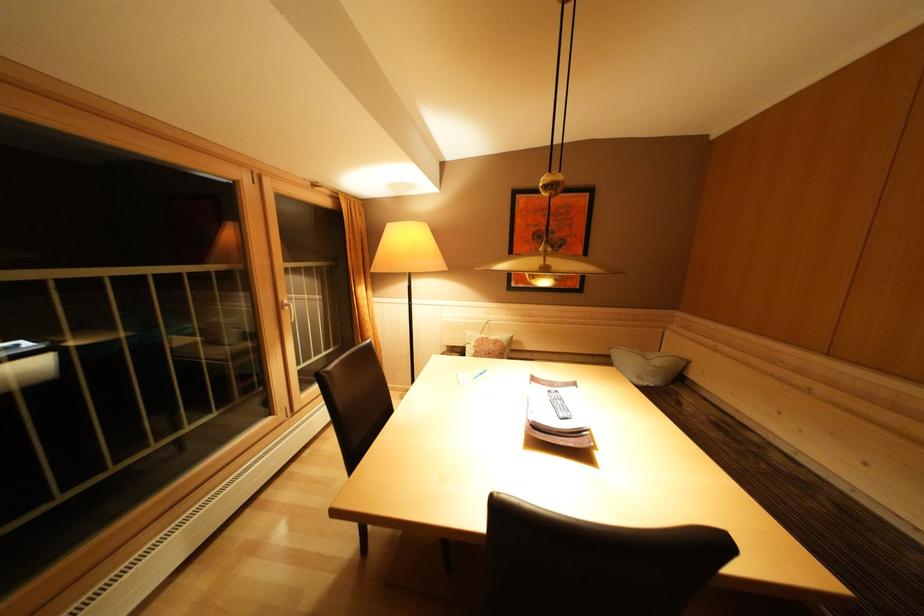
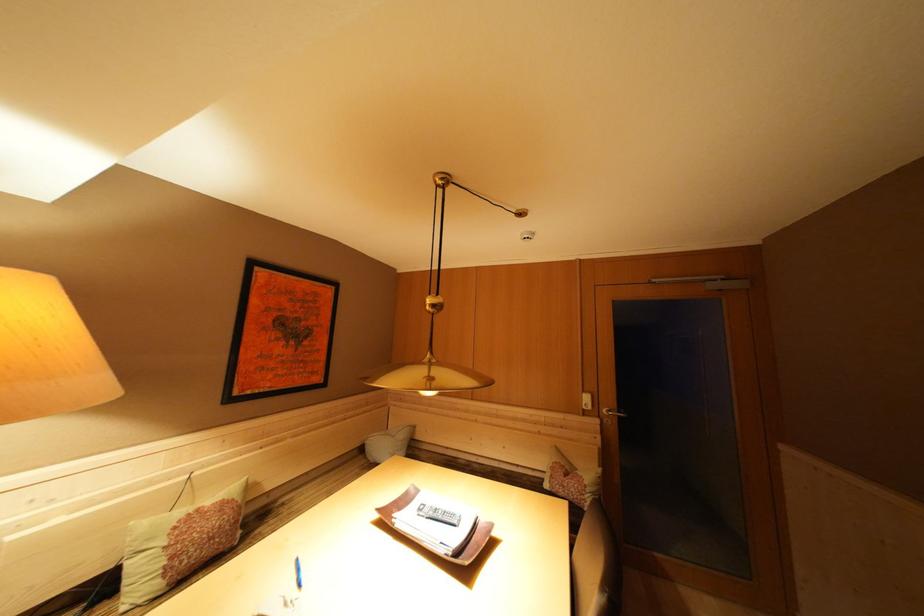
Locate, in the second image, the point that corresponds to pixel 556 397 in the first image.

(427, 515)